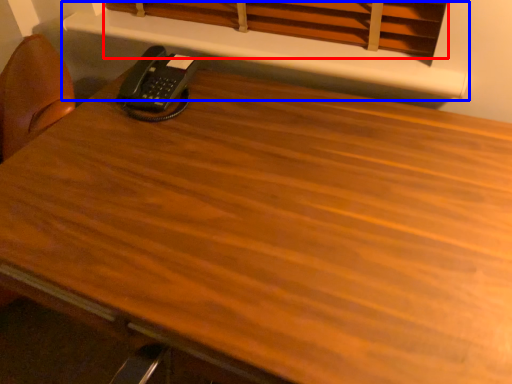
Question: Which object appears farthest to the camera in this image, curtain (highlighted by a red box) or shelf (highlighted by a blue box)?

Choices:
 (A) curtain
 (B) shelf

Answer: (B)